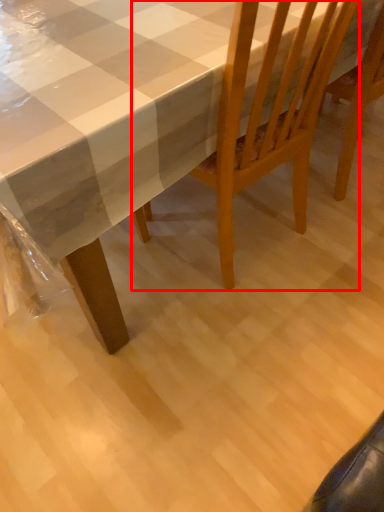
Question: Considering the relative positions of chair (annotated by the red box) and table in the image provided, where is chair (annotated by the red box) located with respect to the staircase?

Choices:
 (A) left
 (B) right

Answer: (B)